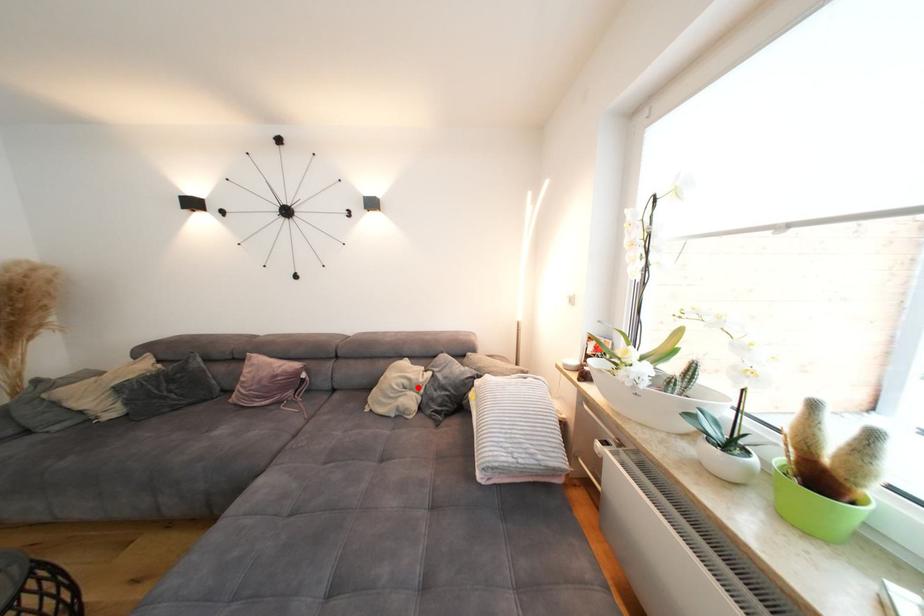
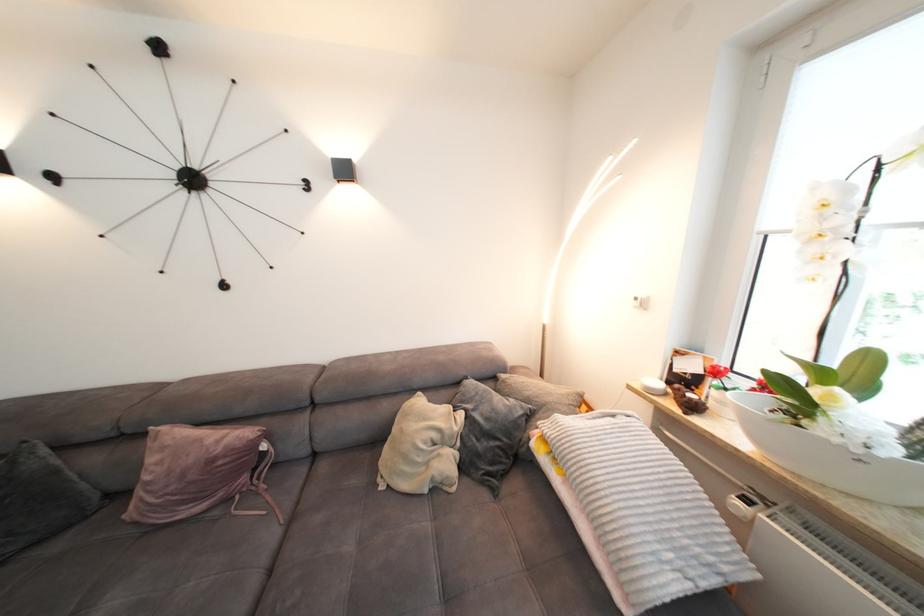
The point at the highlighted location is marked in the first image. Where is the corresponding point in the second image?

(450, 440)